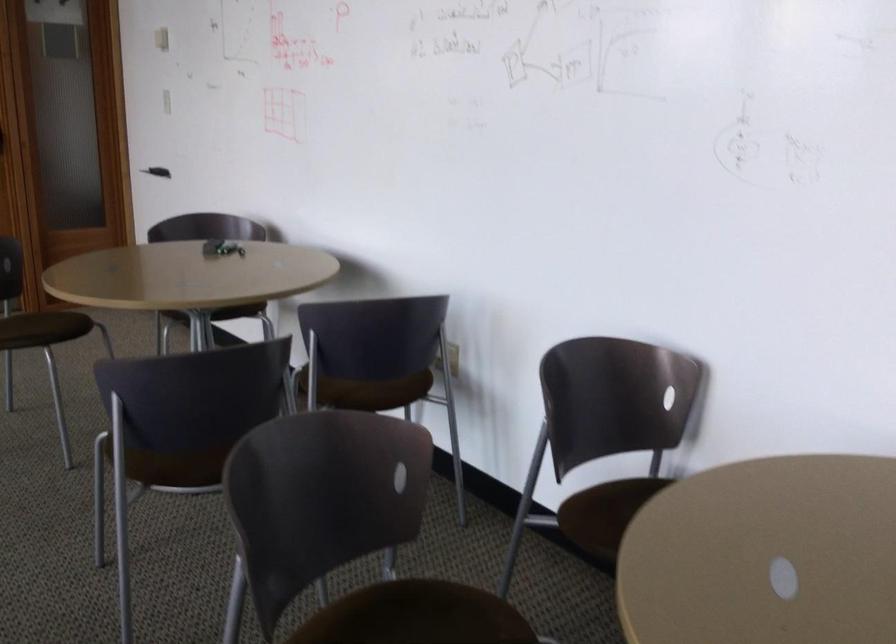
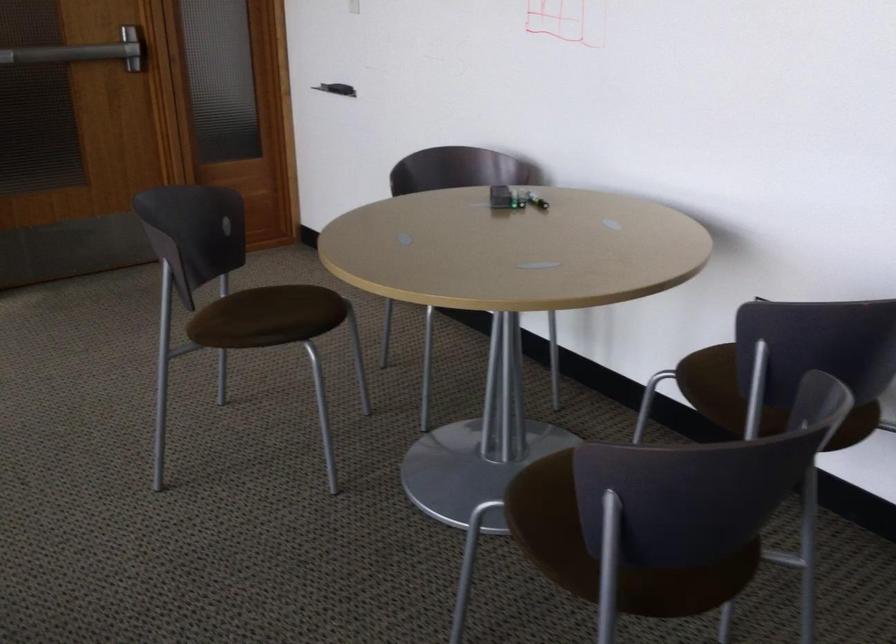
Find the pixel in the second image that matches point (329, 363) in the first image.

(745, 386)